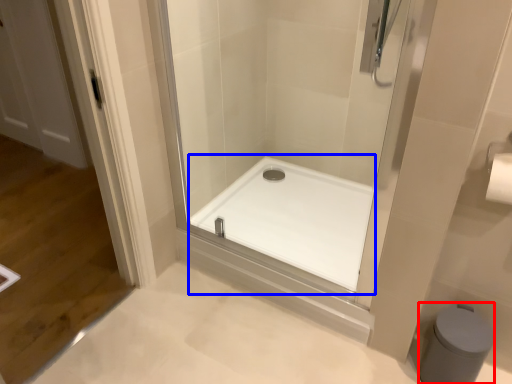
Question: Which point is closer to the camera, bidet (highlighted by a red box) or bath (highlighted by a blue box)?

Choices:
 (A) bidet
 (B) bath

Answer: (A)